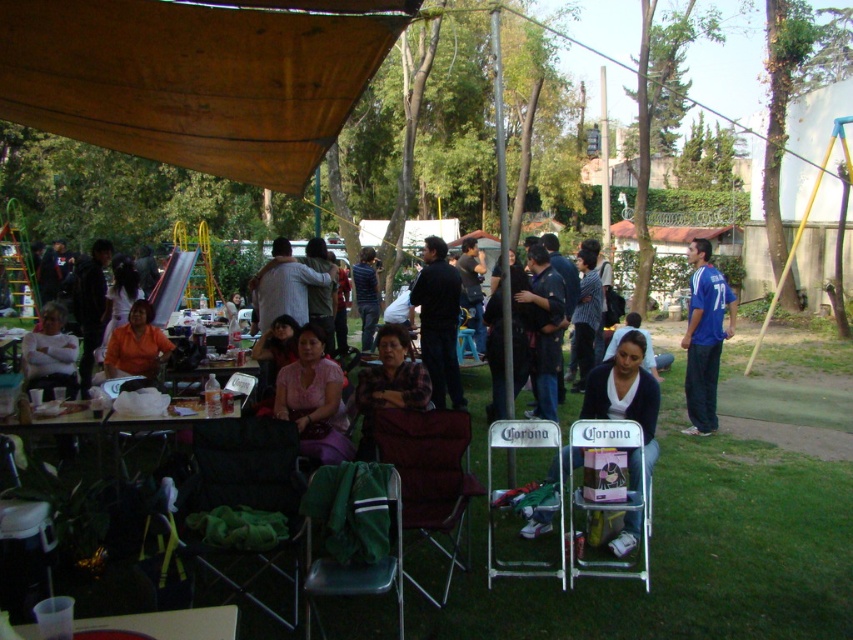
You are a person who is 5 feet tall. You want to sit at the wooden table at center but you are currently sitting at the dark green fabric chair at lower left. Can you easily reach the table without moving your chair?

The distance between dark green fabric chair at lower left and wooden table at center is 3.72 feet, so yes, a person who is 5 feet tall can easily reach the table without moving their chair since the distance is within a comfortable arm reach.

You are a photographer setting up for an event. You have a maroon fabric chair at center and a matte white shirt at left in your frame. Which object should you focus on if you want to capture the larger item in your shot?

The maroon fabric chair at center is larger in size than the matte white shirt at left, so you should focus on the maroon fabric chair at center to capture the larger item in your shot.